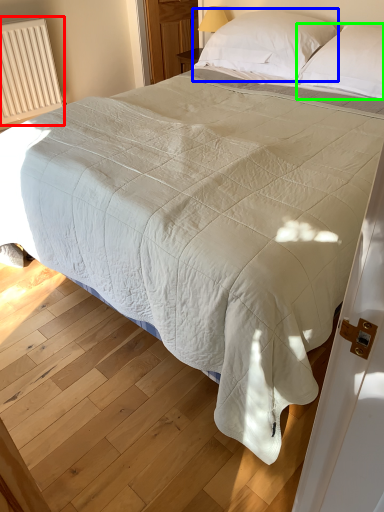
Question: Estimate the real-world distances between objects in this image. Which object is closer to radiator (highlighted by a red box), pillow (highlighted by a blue box) or pillow (highlighted by a green box)?

Choices:
 (A) pillow
 (B) pillow

Answer: (A)